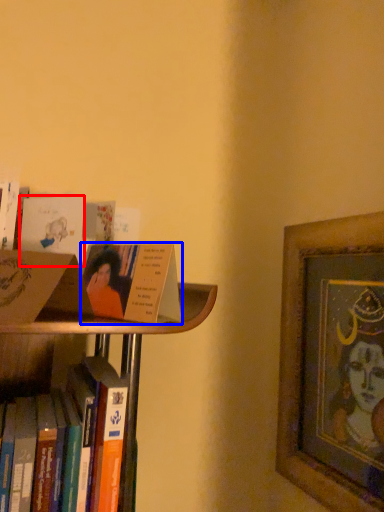
Question: Among these objects, which one is nearest to the camera, paperback book (highlighted by a red box) or book (highlighted by a blue box)?

Choices:
 (A) paperback book
 (B) book

Answer: (B)